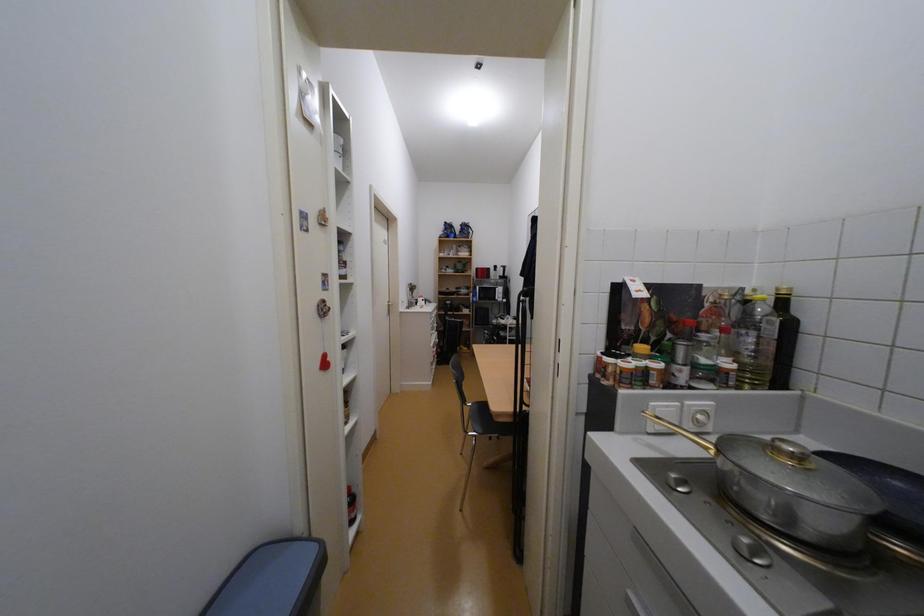
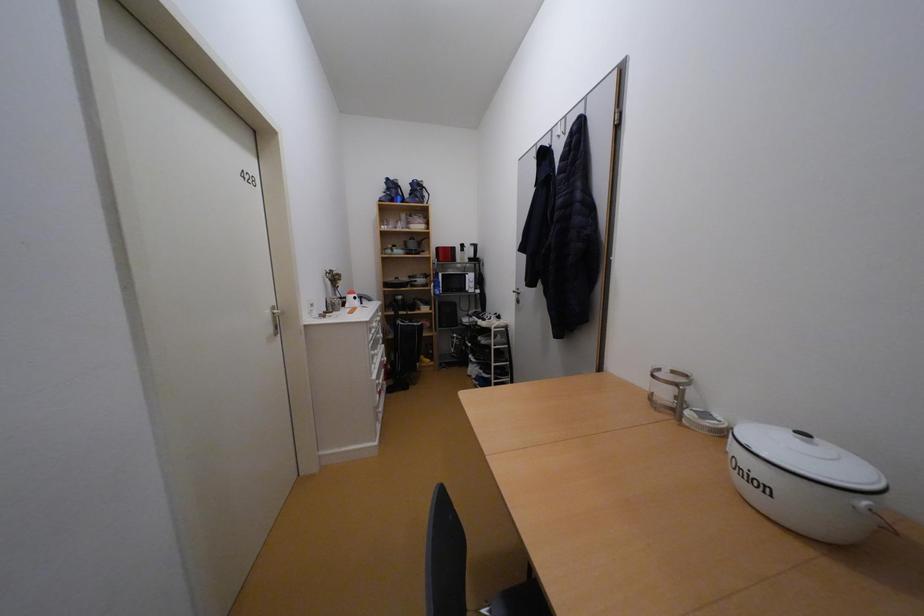
Question: The images are taken continuously from a first-person perspective. In which direction are you moving?

Choices:
 (A) Left
 (B) Right
 (C) Forward
 (D) Backward

Answer: (C)